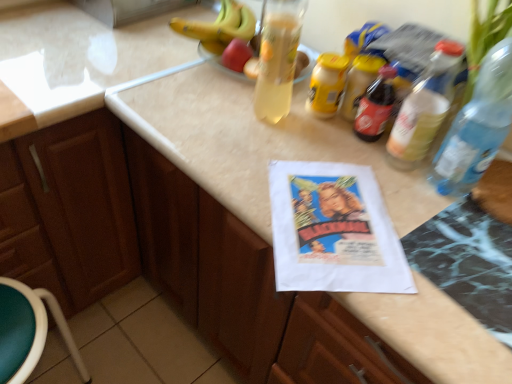
Question: Considering the relative sizes of transparent plastic bottle at right, the second bottle positioned from the left, and translucent plastic bottle at upper right, which is the second bottle in right-to-left order, in the image provided, is transparent plastic bottle at right, the second bottle positioned from the left, thinner than translucent plastic bottle at upper right, which is the second bottle in right-to-left order,?

Choices:
 (A) yes
 (B) no

Answer: (B)

Question: Is transparent plastic bottle at right, the 1th bottle when ordered from right to left, bigger than translucent plastic bottle at upper right, which is the second bottle in right-to-left order?

Choices:
 (A) yes
 (B) no

Answer: (A)

Question: Considering the relative sizes of transparent plastic bottle at right, the second bottle positioned from the left, and translucent plastic bottle at upper right, which is the second bottle in right-to-left order, in the image provided, is transparent plastic bottle at right, the second bottle positioned from the left, taller than translucent plastic bottle at upper right, which is the second bottle in right-to-left order,?

Choices:
 (A) yes
 (B) no

Answer: (A)

Question: Considering the relative sizes of transparent plastic bottle at right, the second bottle positioned from the left, and translucent plastic bottle at upper right, which is the second bottle in right-to-left order, in the image provided, is transparent plastic bottle at right, the second bottle positioned from the left, wider than translucent plastic bottle at upper right, which is the second bottle in right-to-left order,?

Choices:
 (A) no
 (B) yes

Answer: (B)

Question: Does transparent plastic bottle at right, the 1th bottle when ordered from right to left, have a smaller size compared to translucent plastic bottle at upper right, which is the second bottle in right-to-left order?

Choices:
 (A) no
 (B) yes

Answer: (A)

Question: Looking at their shapes, would you say translucent plastic bottle at upper right, which is the first bottle in left-to-right order, is wider or thinner than green plastic stool at lower left?

Choices:
 (A) wide
 (B) thin

Answer: (B)

Question: From a real-world perspective, relative to green plastic stool at lower left, is translucent plastic bottle at upper right, which is the second bottle in right-to-left order, vertically above or below?

Choices:
 (A) above
 (B) below

Answer: (A)

Question: Do you think translucent plastic bottle at upper right, which is the first bottle in left-to-right order, is within green plastic stool at lower left, or outside of it?

Choices:
 (A) outside
 (B) inside

Answer: (A)

Question: Is translucent plastic bottle at upper right, which is the second bottle in right-to-left order, bigger or smaller than green plastic stool at lower left?

Choices:
 (A) big
 (B) small

Answer: (B)

Question: Considering the positions of translucent plastic bottle at upper right, which is the second bottle in right-to-left order, and transparent plastic bottle at right, the 1th bottle when ordered from right to left, in the image, is translucent plastic bottle at upper right, which is the second bottle in right-to-left order, taller or shorter than transparent plastic bottle at right, the 1th bottle when ordered from right to left,?

Choices:
 (A) tall
 (B) short

Answer: (B)

Question: Visually, is translucent plastic bottle at upper right, which is the first bottle in left-to-right order, positioned to the left or to the right of transparent plastic bottle at right, the 1th bottle when ordered from right to left?

Choices:
 (A) left
 (B) right

Answer: (A)

Question: Is translucent plastic bottle at upper right, which is the second bottle in right-to-left order, wider or thinner than transparent plastic bottle at right, the 1th bottle when ordered from right to left?

Choices:
 (A) wide
 (B) thin

Answer: (B)

Question: Is point (434, 69) positioned closer to the camera than point (480, 107)?

Choices:
 (A) farther
 (B) closer

Answer: (A)

Question: From the image's perspective, is brown wood cabinet at left above or below transparent plastic bottle at right, the 1th bottle when ordered from right to left?

Choices:
 (A) below
 (B) above

Answer: (A)

Question: Would you say brown wood cabinet at left is inside or outside transparent plastic bottle at right, the second bottle positioned from the left?

Choices:
 (A) inside
 (B) outside

Answer: (B)